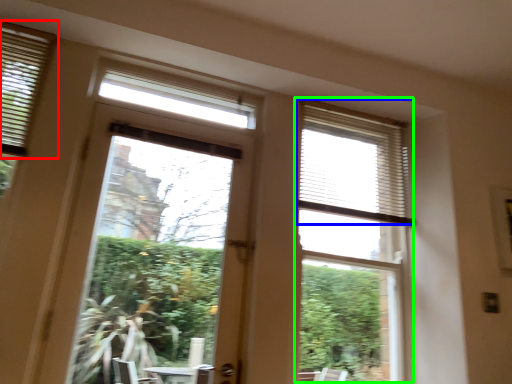
Question: Which object is the farthest from window blind (highlighted by a red box)? Choose among these: blind (highlighted by a blue box) or bay window (highlighted by a green box).

Choices:
 (A) blind
 (B) bay window

Answer: (B)